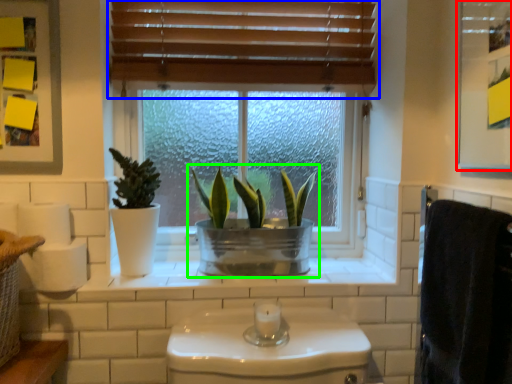
Question: Estimate the real-world distances between objects in this image. Which object is farther from medicine cabinet (highlighted by a red box), window blind (highlighted by a blue box) or houseplant (highlighted by a green box)?

Choices:
 (A) window blind
 (B) houseplant

Answer: (B)